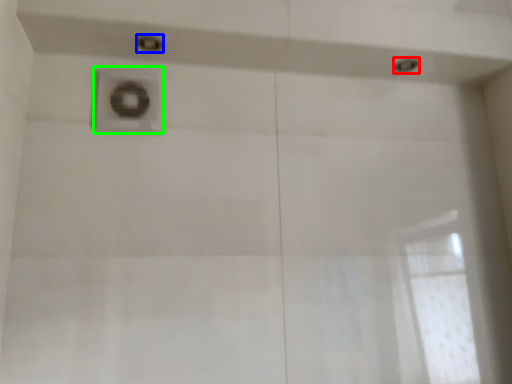
Question: Estimate the real-world distances between objects in this image. Which object is closer to shower (highlighted by a red box), shower (highlighted by a blue box) or plumbing fixture (highlighted by a green box)?

Choices:
 (A) shower
 (B) plumbing fixture

Answer: (A)